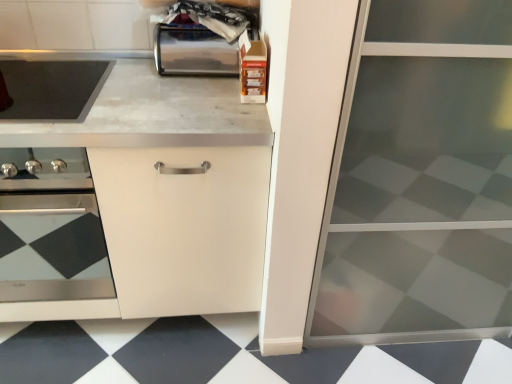
The width and height of the screenshot is (512, 384). In order to click on vacant space in front of shiny metallic toaster at upper center in this screenshot , I will do `click(181, 94)`.